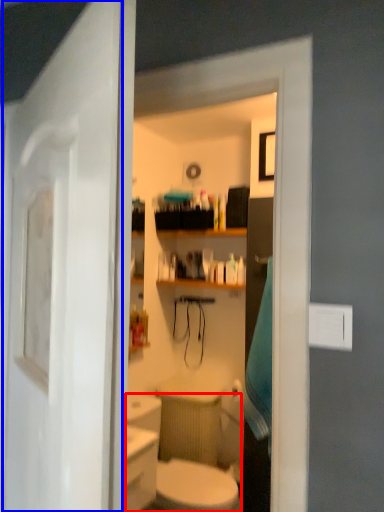
Question: Which of the following is the closest to the observer, sink (highlighted by a red box) or door (highlighted by a blue box)?

Choices:
 (A) sink
 (B) door

Answer: (B)